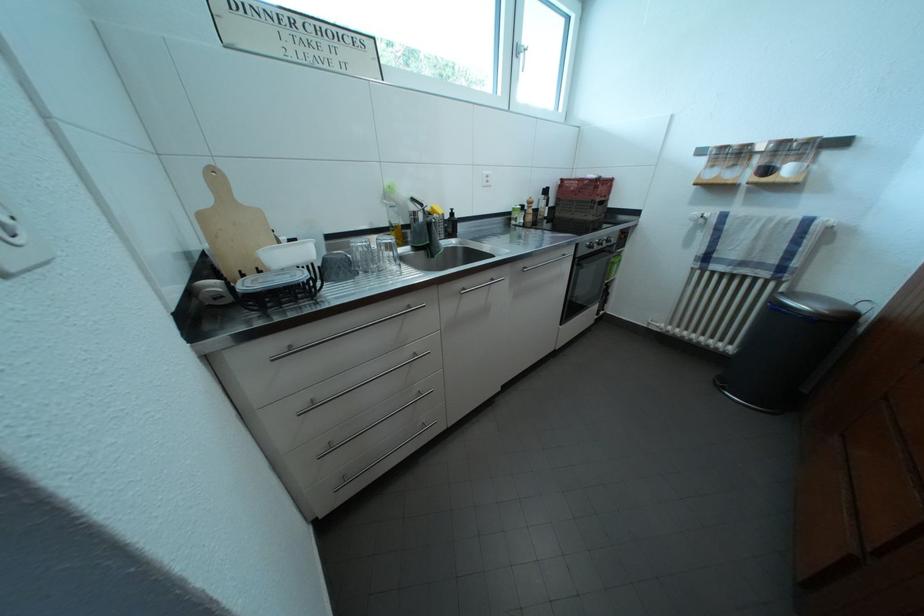
Find where to push the white light switch. Please return your answer as a coordinate pair (x, y).

(485, 179)